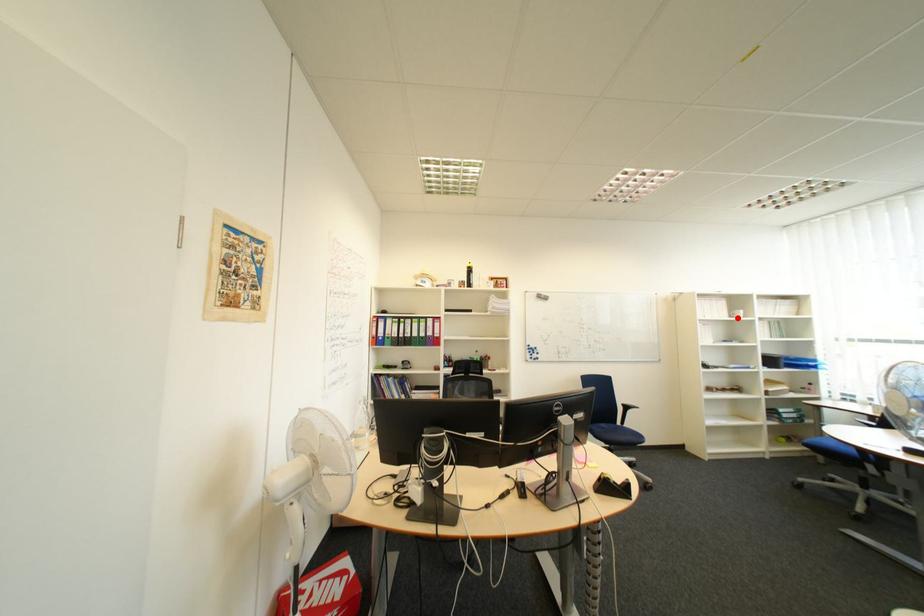
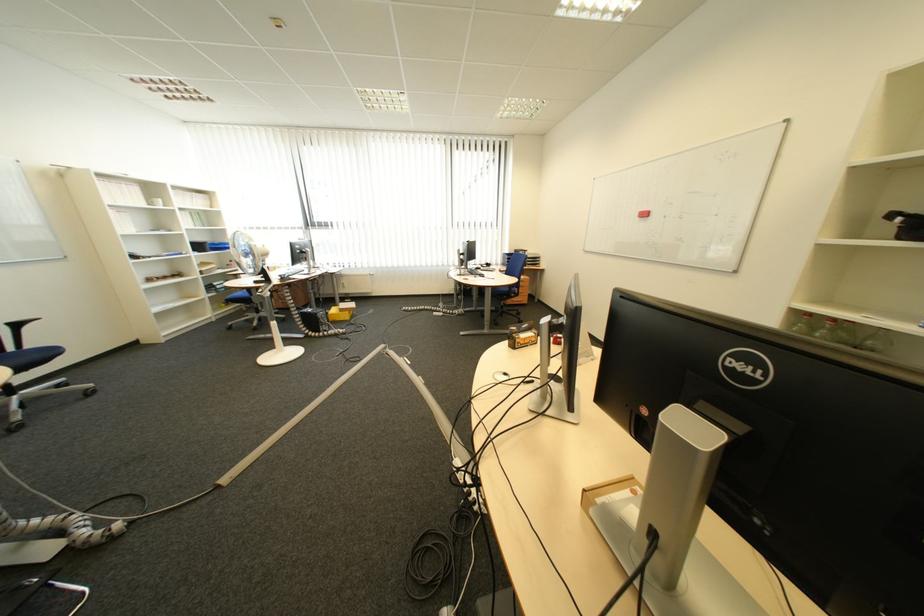
Question: I am providing you with two images of the same scene from different viewpoints. A red point is marked on the first image. At the location where the point appears in image 1, is it still visible in image 2?

Choices:
 (A) Yes
 (B) No

Answer: (A)